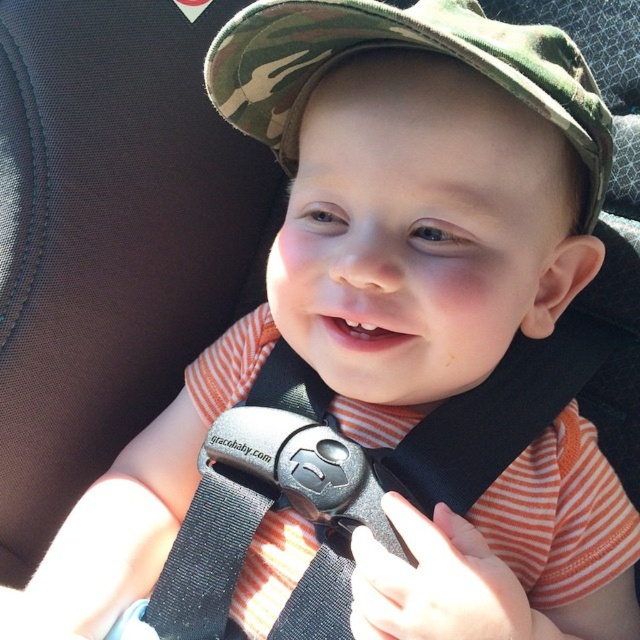
Question: Is black fabric seatbelt at center smaller than camo fabric hat at center?

Choices:
 (A) yes
 (B) no

Answer: (B)

Question: Which point is farther to the camera?

Choices:
 (A) camo fabric hat at center
 (B) black fabric seatbelt at center

Answer: (B)

Question: Is black fabric seatbelt at center in front of camo fabric hat at center?

Choices:
 (A) no
 (B) yes

Answer: (A)

Question: Considering the relative positions of black fabric seatbelt at center and camo fabric hat at center in the image provided, where is black fabric seatbelt at center located with respect to camo fabric hat at center?

Choices:
 (A) above
 (B) below

Answer: (B)

Question: Which of the following is the closest to the observer?

Choices:
 (A) camo fabric hat at center
 (B) black fabric seatbelt at center

Answer: (A)